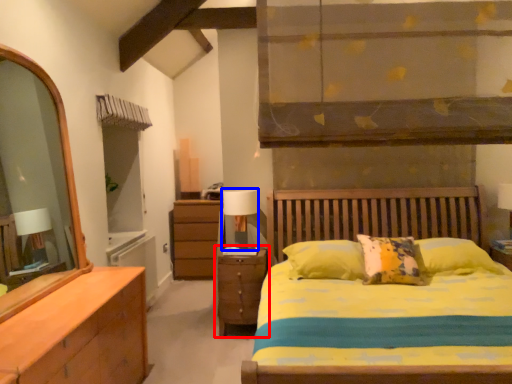
Question: Which of the following is the farthest to the observer, nightstand (highlighted by a red box) or table lamp (highlighted by a blue box)?

Choices:
 (A) nightstand
 (B) table lamp

Answer: (B)